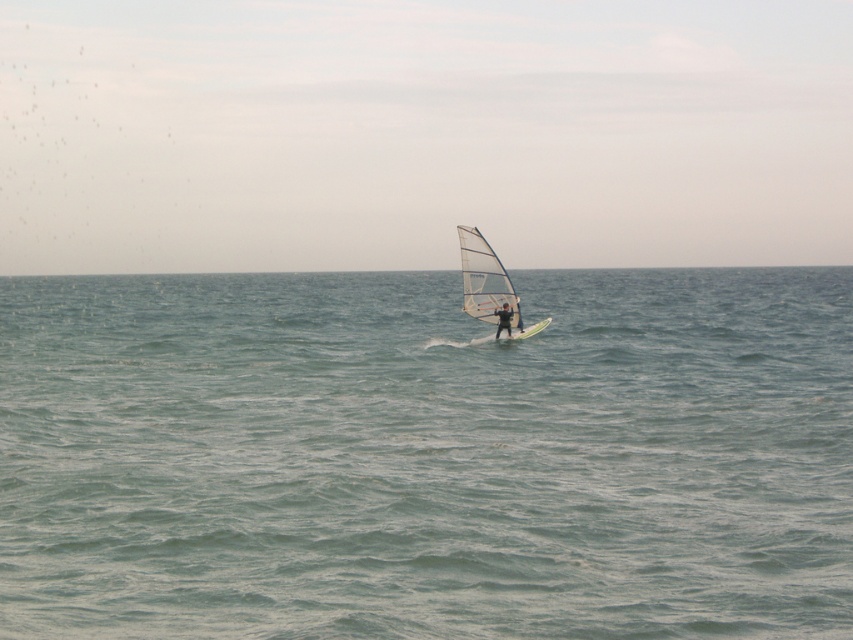
Question: Which point appears closest to the camera in this image?

Choices:
 (A) (476, 284)
 (B) (512, 337)

Answer: (A)

Question: Is green matte surfboard at center thinner than matte black windsurfer at center?

Choices:
 (A) no
 (B) yes

Answer: (A)

Question: In this image, where is green matte surfboard at center located relative to matte black windsurfer at center?

Choices:
 (A) below
 (B) above

Answer: (A)

Question: Estimate the real-world distances between objects in this image. Which object is closer to the white matte sail at center?

Choices:
 (A) green matte surfboard at center
 (B) transparent sail at center
 (C) clear blue water at center

Answer: (A)

Question: Among these objects, which one is farthest from the camera?

Choices:
 (A) clear blue water at center
 (B) matte black windsurfer at center

Answer: (B)

Question: Where is clear blue water at center located in relation to matte black windsurfer at center in the image?

Choices:
 (A) left
 (B) right

Answer: (B)